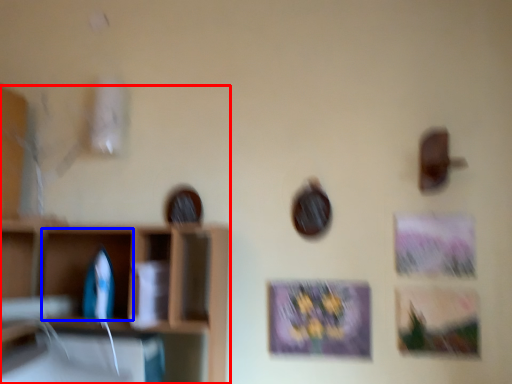
Question: Among these objects, which one is farthest to the camera, shelf (highlighted by a red box) or cabinet (highlighted by a blue box)?

Choices:
 (A) shelf
 (B) cabinet

Answer: (B)